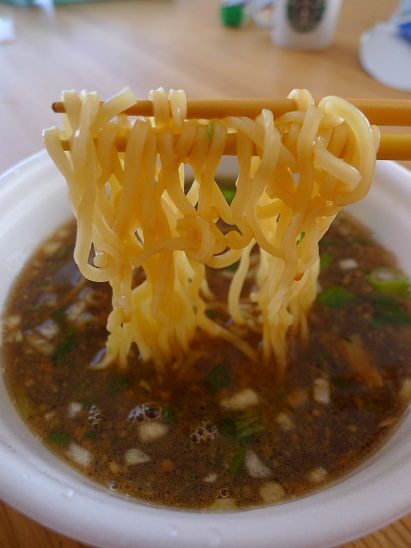
The height and width of the screenshot is (548, 411). Identify the location of chopsticks. (387, 109), (393, 142).